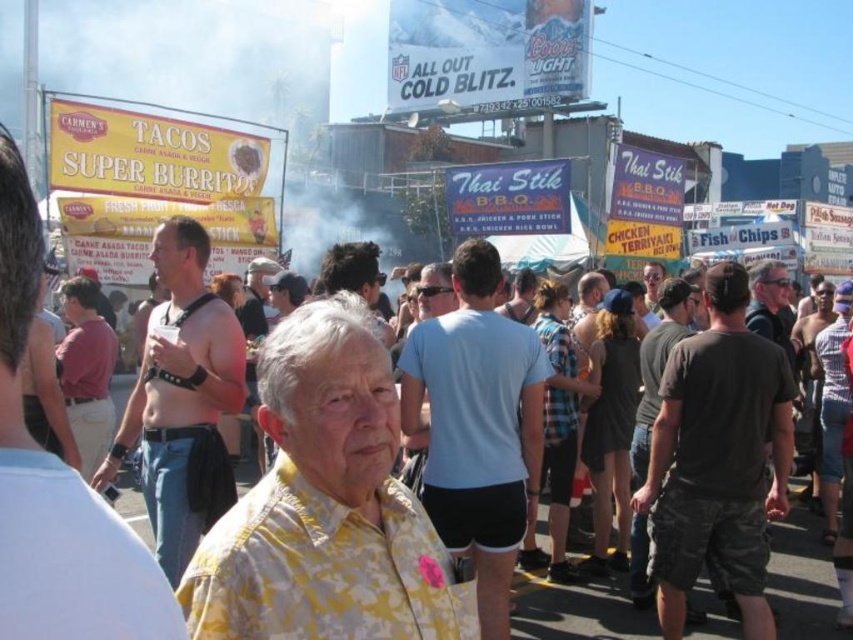
Question: Which object appears farthest from the camera in this image?

Choices:
 (A) light brown leather belt at left
 (B) matte black sunglasses at center
 (C) yellow printed shirt at center
 (D) dark gray camo shorts at center

Answer: (B)

Question: Which object is positioned closest to the light blue fabric shirt at center?

Choices:
 (A) shiny black tank top at center
 (B) dark gray t-shirt at center-right

Answer: (B)

Question: Among these objects, which one is nearest to the camera?

Choices:
 (A) dark gray camo shorts at center
 (B) light blue fabric shirt at center

Answer: (A)

Question: Does shiny black tank top at center come behind matte black sunglasses at center?

Choices:
 (A) no
 (B) yes

Answer: (A)

Question: Does light brown leather belt at left appear on the right side of dark gray t-shirt at center-right?

Choices:
 (A) no
 (B) yes

Answer: (A)

Question: Is yellow printed shirt at center smaller than dark gray camo shorts at center?

Choices:
 (A) yes
 (B) no

Answer: (B)